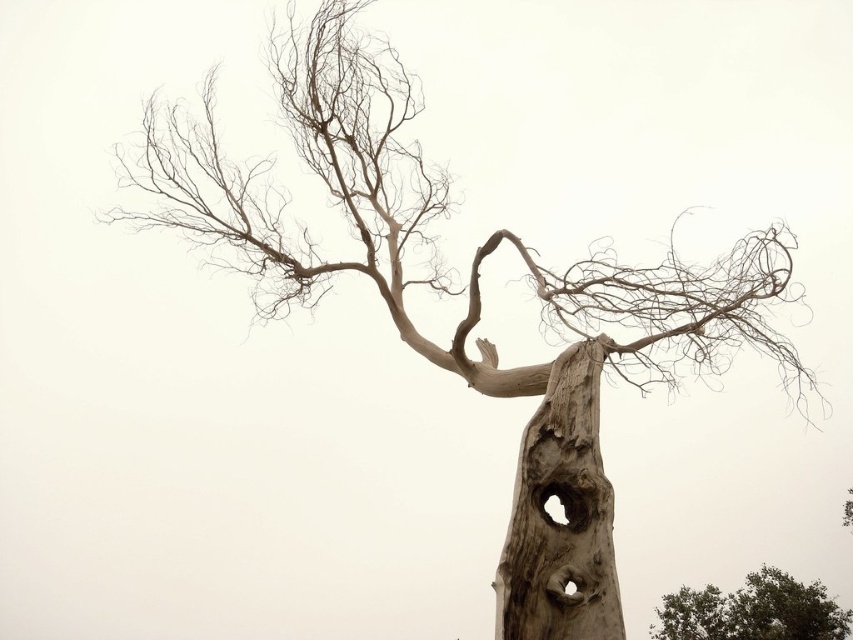
Question: Is gray rough bark tree trunk at center wider than green leafy tree at lower right?

Choices:
 (A) yes
 (B) no

Answer: (B)

Question: Is gray rough bark tree trunk at center positioned before green leafy tree at lower right?

Choices:
 (A) yes
 (B) no

Answer: (A)

Question: Is gray rough bark tree trunk at center positioned in front of green leafy tree at lower right?

Choices:
 (A) yes
 (B) no

Answer: (A)